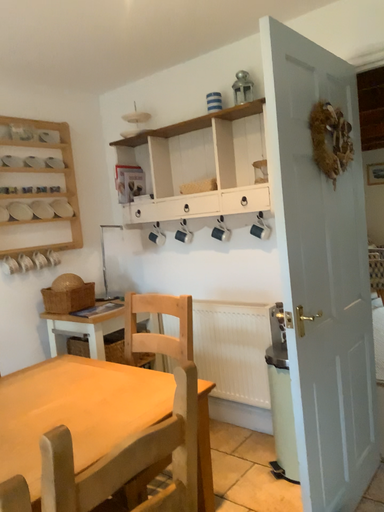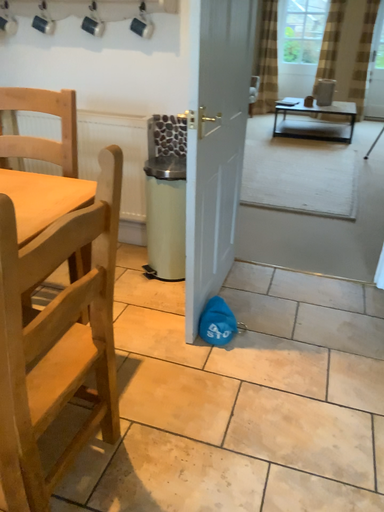
Question: How did the camera likely rotate when shooting the video?

Choices:
 (A) rotated right
 (B) rotated left

Answer: (A)